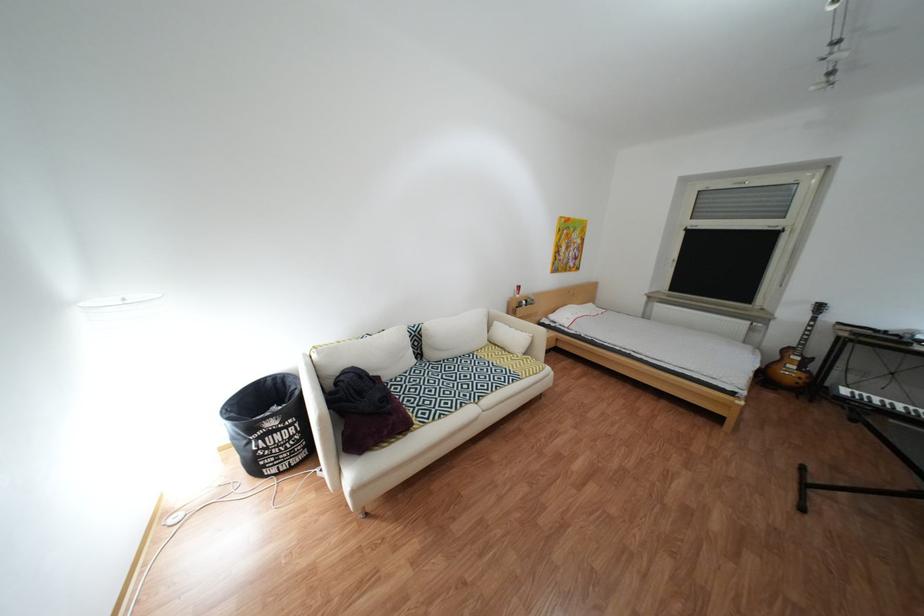
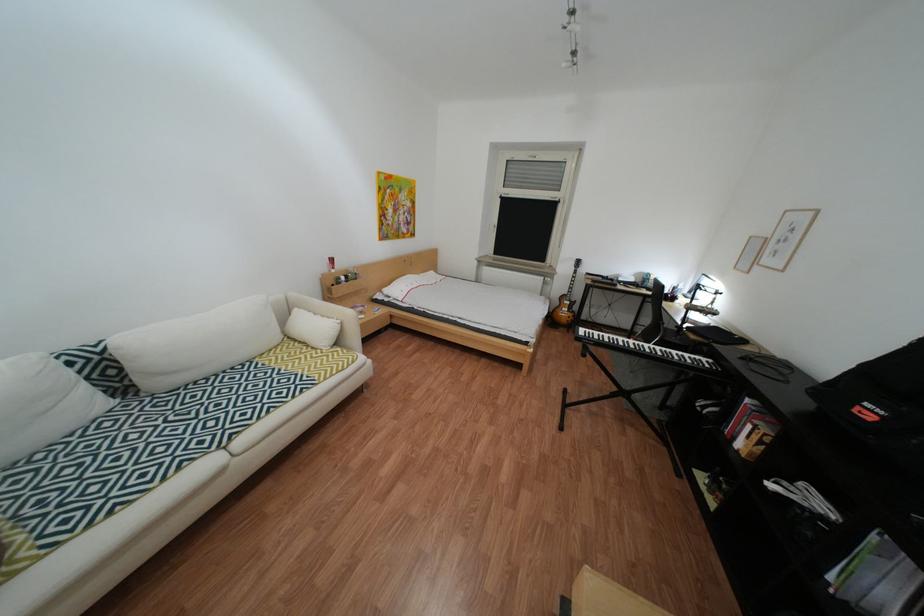
Find the pixel in the second image that matches point (781, 379) in the first image.

(566, 323)